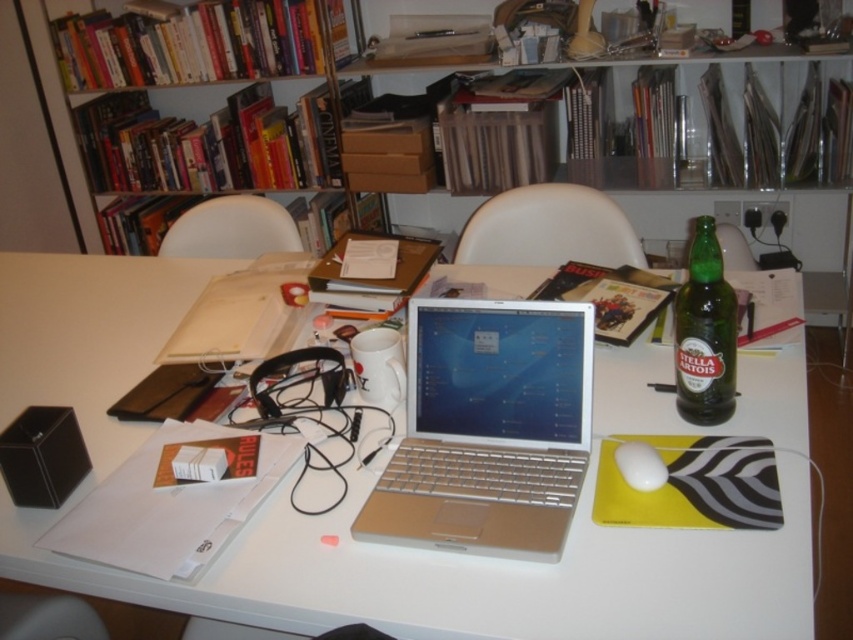
Question: Is green glass bottle at right closer to the viewer compared to white matte mouse at center?

Choices:
 (A) yes
 (B) no

Answer: (B)

Question: Does white plastic table at center appear under wooden bookshelf at upper left?

Choices:
 (A) no
 (B) yes

Answer: (B)

Question: Which of these objects is positioned closest to the white plastic table at center?

Choices:
 (A) green glass bottle at right
 (B) white matte mouse at center
 (C) silver metallic laptop at center
 (D) wooden bookshelf at upper left

Answer: (C)

Question: Which object is the closest to the wooden bookshelf at upper left?

Choices:
 (A) white matte mouse at center
 (B) green glass bottle at right
 (C) white plastic table at center
 (D) silver metallic laptop at center

Answer: (C)

Question: Which object appears closest to the camera in this image?

Choices:
 (A) green glass bottle at right
 (B) silver metallic laptop at center
 (C) white matte mouse at center

Answer: (B)

Question: Does wooden bookshelf at upper left have a greater width compared to white matte mouse at center?

Choices:
 (A) no
 (B) yes

Answer: (B)